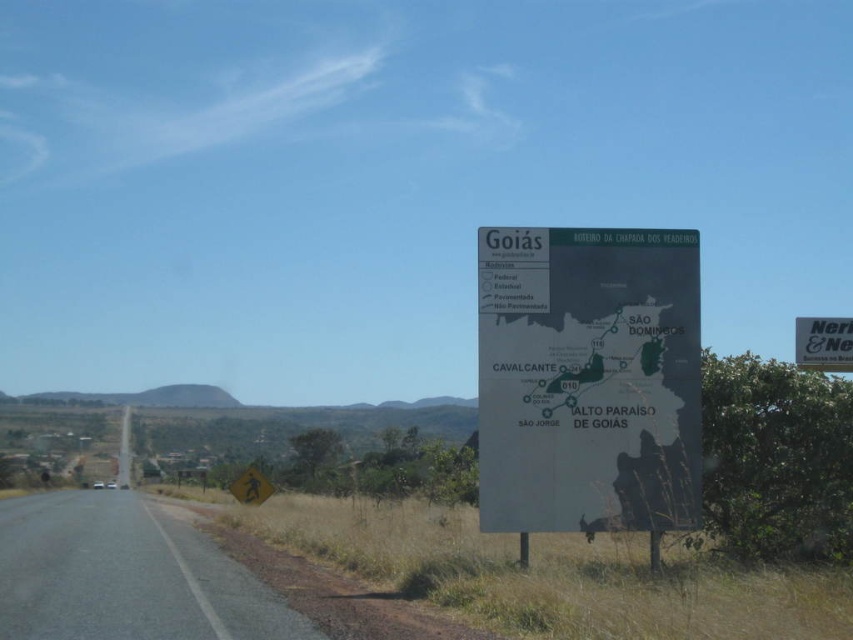
Question: Does gray asphalt road at lower left have a smaller size compared to white plastic sign at right?

Choices:
 (A) yes
 (B) no

Answer: (A)

Question: Which object is closer to the camera taking this photo?

Choices:
 (A) white plastic sign at right
 (B) matte black map at right

Answer: (B)

Question: Which object is positioned closest to the gray asphalt road at lower left?

Choices:
 (A) matte black map at right
 (B) white plastic sign at right

Answer: (A)

Question: Is matte black map at right smaller than gray asphalt road at lower left?

Choices:
 (A) yes
 (B) no

Answer: (A)

Question: Can you confirm if matte black map at right is positioned above gray asphalt road at lower left?

Choices:
 (A) yes
 (B) no

Answer: (A)

Question: Which point is farther to the camera?

Choices:
 (A) (827, 355)
 (B) (633, 243)
 (C) (39, 593)

Answer: (A)